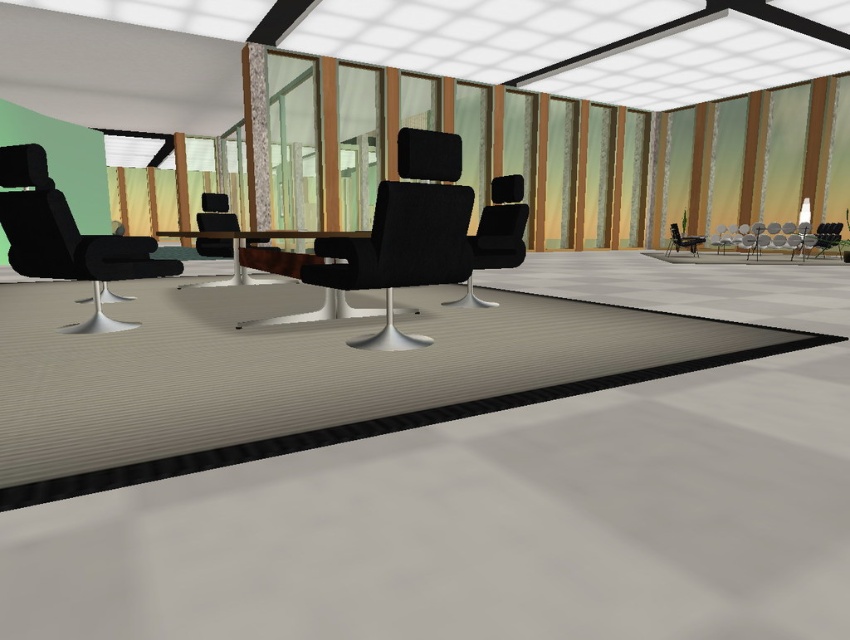
You are a delivery person entering the room and need to place a package between the metallic silver chair at right and the matte black chair at right. The package requires 6 feet of space to fit. Can you place it there?

The metallic silver chair at right and matte black chair at right are 6.14 feet apart from each other, so yes, the package requiring 6 feet of space can be placed between them since the distance is sufficient.

You are organizing a meeting in this room and need to seat two guests. You have a metallic silver chair at right and a matte black chair at right available. Which chair should you choose if you want to provide more seating space for a guest with limited mobility?

The metallic silver chair at right is larger in size than the matte black chair at right, so it would provide more seating space for a guest with limited mobility.